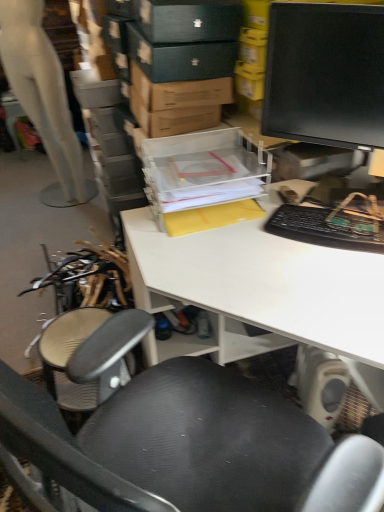
Question: Would you say white matte mannequin at left is to the left or to the right of black textured chair at center in the picture?

Choices:
 (A) right
 (B) left

Answer: (B)

Question: Is white matte mannequin at left spatially inside black textured chair at center, or outside of it?

Choices:
 (A) inside
 (B) outside

Answer: (B)

Question: Considering the real-world distances, which object is farthest from the black plastic keyboard at right?

Choices:
 (A) transparent plastic storage box at center
 (B) matte black monitor at upper right
 (C) black textured chair at center
 (D) white matte mannequin at left
 (E) white matte desk at center

Answer: (D)

Question: Which is farther from the white matte mannequin at left?

Choices:
 (A) black textured chair at center
 (B) black plastic keyboard at right
 (C) transparent plastic storage box at center
 (D) white matte desk at center
 (E) matte black monitor at upper right

Answer: (A)